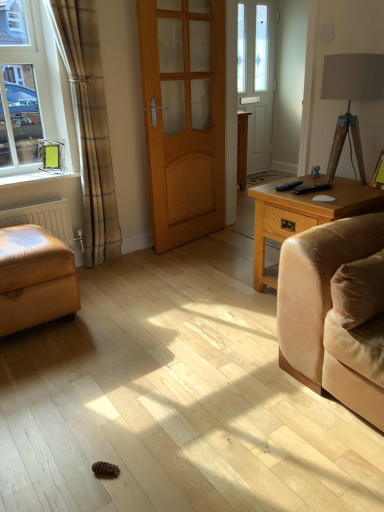
Locate an element on the screen. free space above light brown wooden side table at right (from a real-world perspective) is located at coordinates (324, 184).